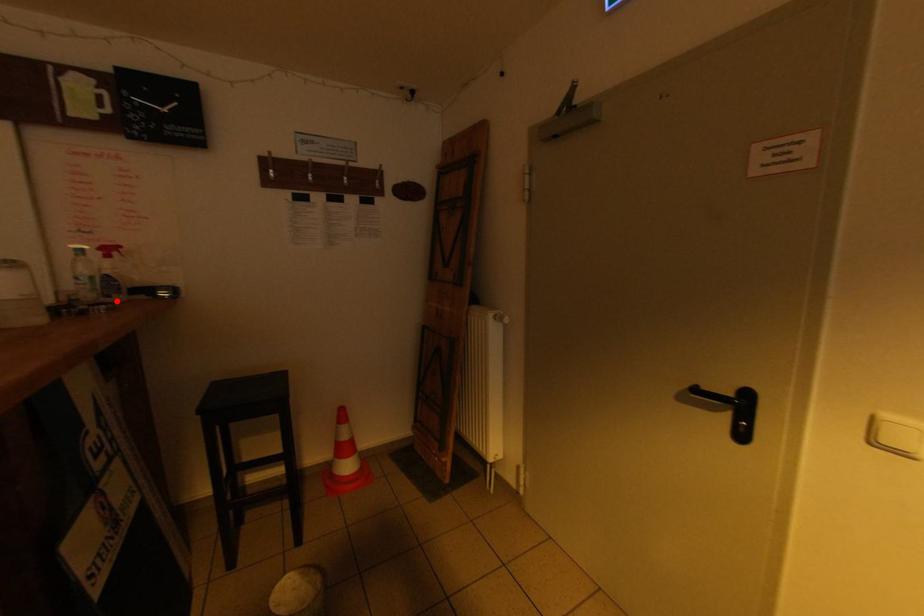
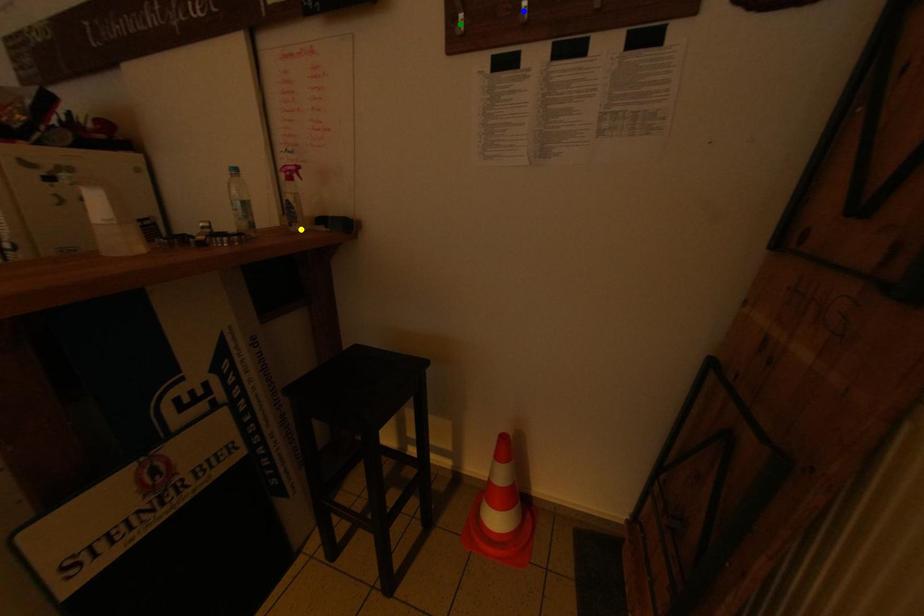
Question: I am providing you with two images of the same scene from different viewpoints. A red point is marked on the first image. You are given multiple points on the second image. In image 2, which mark is for the same physical point as the one in image 1?

Choices:
 (A) yellow point
 (B) green point
 (C) blue point

Answer: (A)